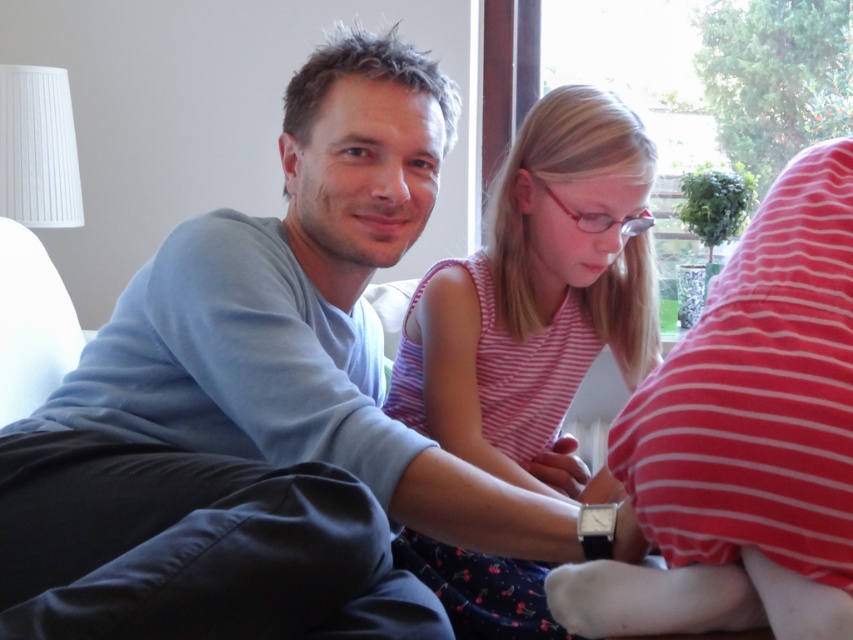
Is light blue sweater at center above striped cotton shirt at center?

Yes, light blue sweater at center is above striped cotton shirt at center.

Does light blue sweater at center have a greater height compared to striped cotton shirt at center?

No.

Is point (323, 572) closer to camera compared to point (505, 285)?

Yes, it is.

At what (x,y) coordinates should I click in order to perform the action: click on light blue sweater at center. Please return your answer as a coordinate pair (x, y). The image size is (853, 640). Looking at the image, I should click on (264, 406).